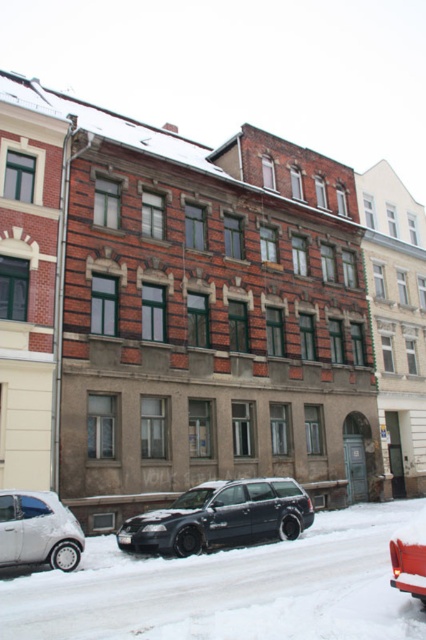
You are a delivery person trying to park your van in the space between the shiny black station wagon at center and the silver metallic car at lower left. Can you estimate if there is enough vertical space between them to park your van that is 2 meters tall?

The shiny black station wagon at center is below the silver metallic car at lower left, meaning the vertical space between them is at least the height of the silver metallic car. Since your van is 2 meters tall, it should fit as long as the vertical clearance is sufficient. However, without exact measurements, it is recommended to check the space physically before attempting to park.

You are a delivery person trying to park your van near the entrance of the building. The entrance is located under the ornate design mentioned in the scene. You see the white powdery snow at center and the metallic silver car at lower right. Which location would allow you to park closer to the entrance?

The white powdery snow at center is below the metallic silver car at lower right, so parking at the white powdery snow at center would be closer to the entrance since it is positioned beneath the car, which is farther away.

You are standing on the snowy street in front of the residential building and want to walk towards the entrance. Which car, the shiny black station wagon at center or the silver metallic car at lower left, is closer to the building?

The silver metallic car at lower left is closer to the building because the shiny black station wagon at center is further to the viewer, meaning the silver metallic car at lower left is positioned behind it and thus nearer to the building.